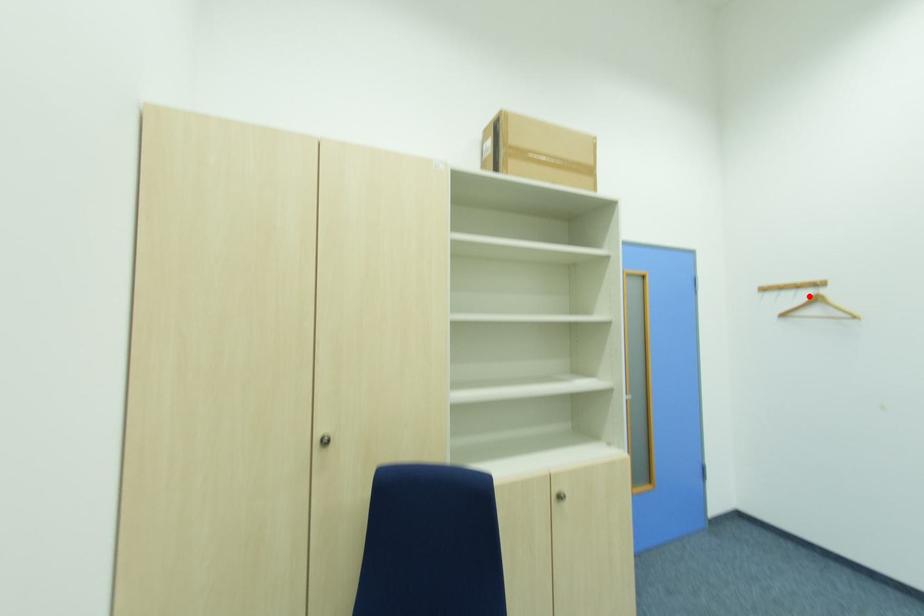
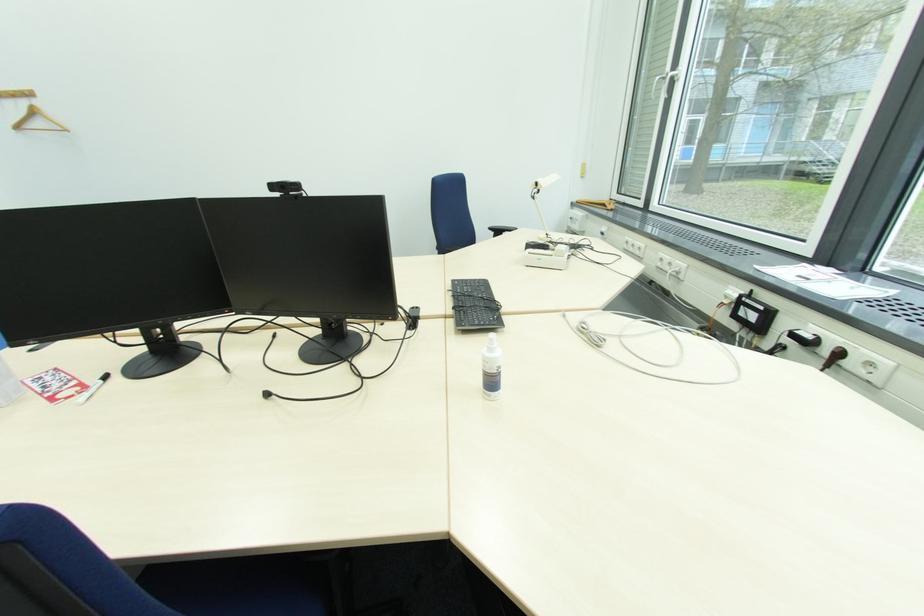
Where in the second image is the point corresponding to the highlighted location from the first image?

(29, 105)